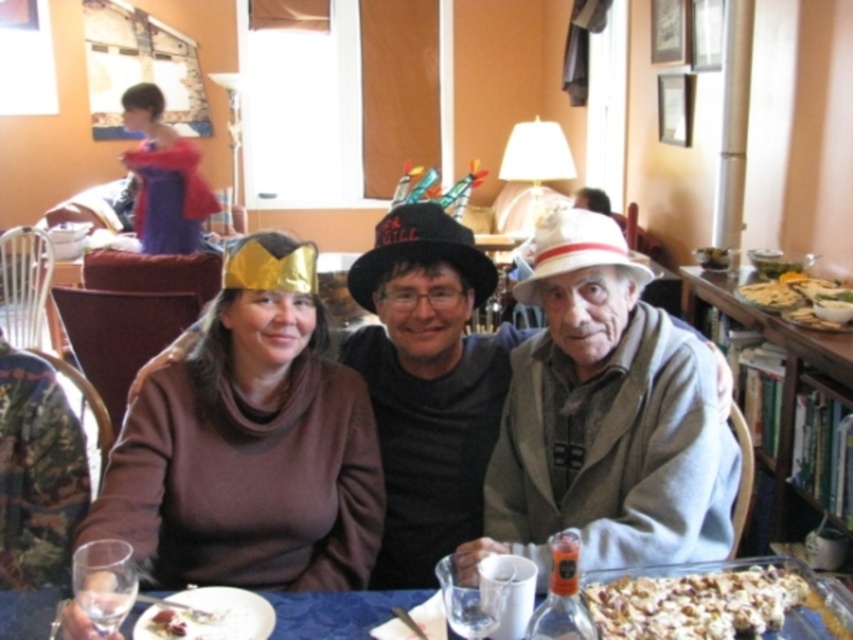
You are a guest at this festive gathering and want to grab a handful of the crumbly brown popcorn at lower right. However, you are currently holding the brown soft sweater at center. Can you easily reach the popcorn without dropping the sweater?

The brown soft sweater at center is above the crumbly brown popcorn at lower right, so you can reach the popcorn while holding the sweater as long as you move your hand downward.

You are a photographer setting up for a group photo in the dining room. You need to place a camera stand at position point 0.716, 0.293. Is the brown matte hat at left currently in the way of this setup?

The brown matte hat at left is located at point (248, 458), so yes, it is in the way of the camera stand placement at that position.